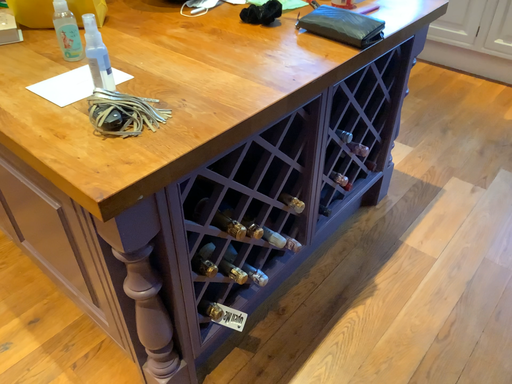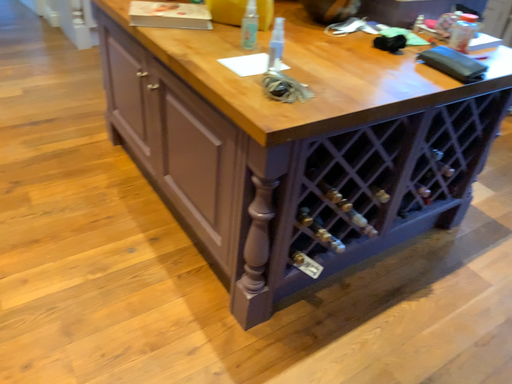
Question: Which way did the camera rotate in the video?

Choices:
 (A) rotated right
 (B) rotated left

Answer: (B)